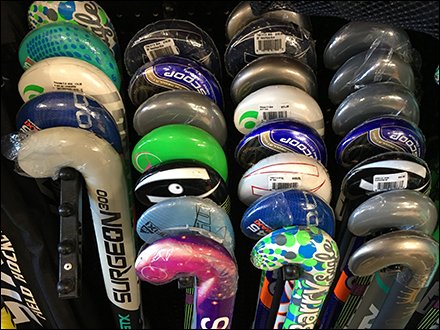
What are the coordinates of `rack` in the screenshot? It's located at (73, 228).